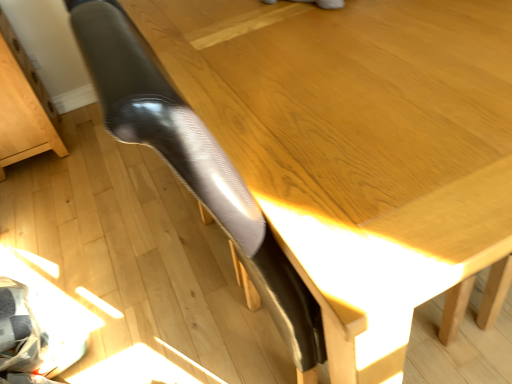
Question: Does point (56, 142) appear closer or farther from the camera than point (108, 33)?

Choices:
 (A) closer
 (B) farther

Answer: (B)

Question: From the image's perspective, relative to glossy black chair leg at center, is light brown wood drawer at lower left above or below?

Choices:
 (A) above
 (B) below

Answer: (A)

Question: Considering the positions of light brown wood drawer at lower left and glossy black chair leg at center in the image, is light brown wood drawer at lower left taller or shorter than glossy black chair leg at center?

Choices:
 (A) tall
 (B) short

Answer: (B)

Question: Based on their positions, is glossy black chair leg at center located to the left or right of light brown wood drawer at lower left?

Choices:
 (A) left
 (B) right

Answer: (B)

Question: Do you think glossy black chair leg at center is within light brown wood drawer at lower left, or outside of it?

Choices:
 (A) outside
 (B) inside

Answer: (A)

Question: Considering the positions of point (258, 238) and point (19, 57), is point (258, 238) closer or farther from the camera than point (19, 57)?

Choices:
 (A) closer
 (B) farther

Answer: (A)

Question: Looking at their shapes, would you say glossy black chair leg at center is wider or thinner than light brown wood drawer at lower left?

Choices:
 (A) wide
 (B) thin

Answer: (B)